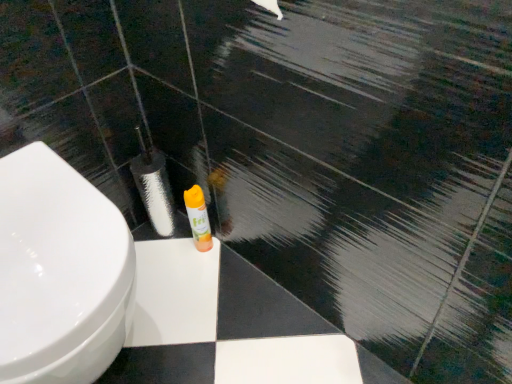
Question: Is orange matte spray can at center in front of or behind white glossy toilet at lower left in the image?

Choices:
 (A) behind
 (B) front

Answer: (A)

Question: From the image's perspective, is orange matte spray can at center located above or below white glossy toilet at lower left?

Choices:
 (A) above
 (B) below

Answer: (A)

Question: Considering the positions of orange matte spray can at center and white glossy toilet at lower left in the image, is orange matte spray can at center taller or shorter than white glossy toilet at lower left?

Choices:
 (A) tall
 (B) short

Answer: (B)

Question: Is white glossy toilet at lower left in front of or behind orange matte spray can at center in the image?

Choices:
 (A) behind
 (B) front

Answer: (B)

Question: Is white glossy toilet at lower left wider or thinner than orange matte spray can at center?

Choices:
 (A) thin
 (B) wide

Answer: (B)

Question: Based on their positions, is white glossy toilet at lower left located to the left or right of orange matte spray can at center?

Choices:
 (A) left
 (B) right

Answer: (A)

Question: From their relative heights in the image, would you say white glossy toilet at lower left is taller or shorter than orange matte spray can at center?

Choices:
 (A) tall
 (B) short

Answer: (A)